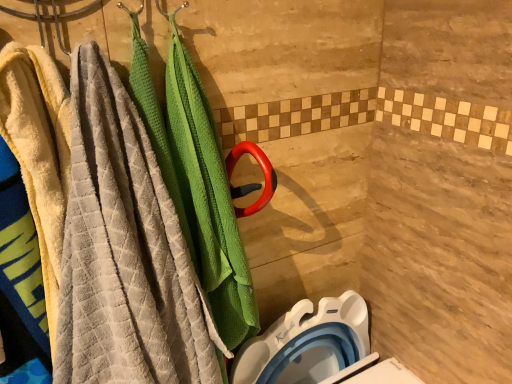
Question: Considering their positions, is soft yellow towel at left located in front of or behind white plastic toilet bowl at lower right?

Choices:
 (A) behind
 (B) front

Answer: (B)

Question: Is point (35, 200) positioned closer to the camera than point (264, 337)?

Choices:
 (A) closer
 (B) farther

Answer: (A)

Question: Which is farther from the white plastic toilet bowl at lower right?

Choices:
 (A) soft yellow towel at left
 (B) textured gray towel at left

Answer: (A)

Question: Which is nearer to the textured gray towel at left?

Choices:
 (A) soft yellow towel at left
 (B) white plastic toilet bowl at lower right

Answer: (A)